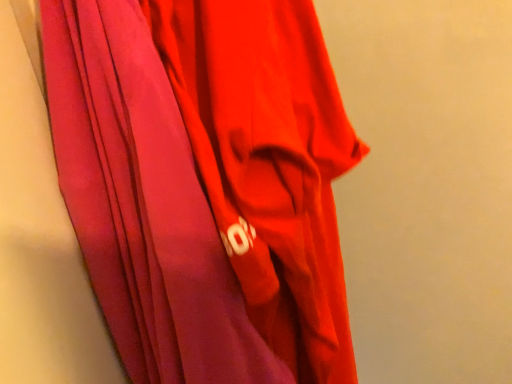
What is the approximate height of matte fabric curtain at upper left?

21.10 inches.

Image resolution: width=512 pixels, height=384 pixels. Find the location of `matte fabric curtain at upper left`. matte fabric curtain at upper left is located at coordinates (205, 184).

This screenshot has height=384, width=512. What do you see at coordinates (205, 184) in the screenshot? I see `matte fabric curtain at upper left` at bounding box center [205, 184].

In order to face matte fabric curtain at upper left, should I rotate leftwards or rightwards?

You should look right and rotate roughly 2.871 degrees.

In order to click on matte fabric curtain at upper left in this screenshot , I will do [x=205, y=184].